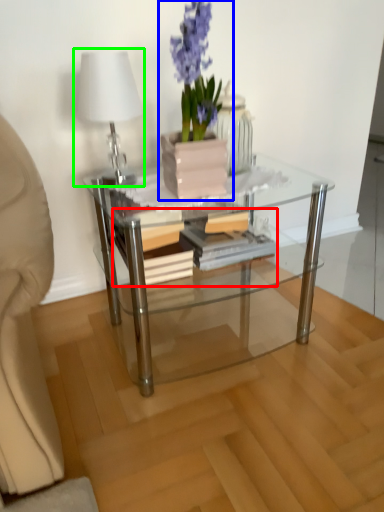
Question: Which is nearer to the book (highlighted by a red box)? houseplant (highlighted by a blue box) or table lamp (highlighted by a green box).

Choices:
 (A) houseplant
 (B) table lamp

Answer: (A)